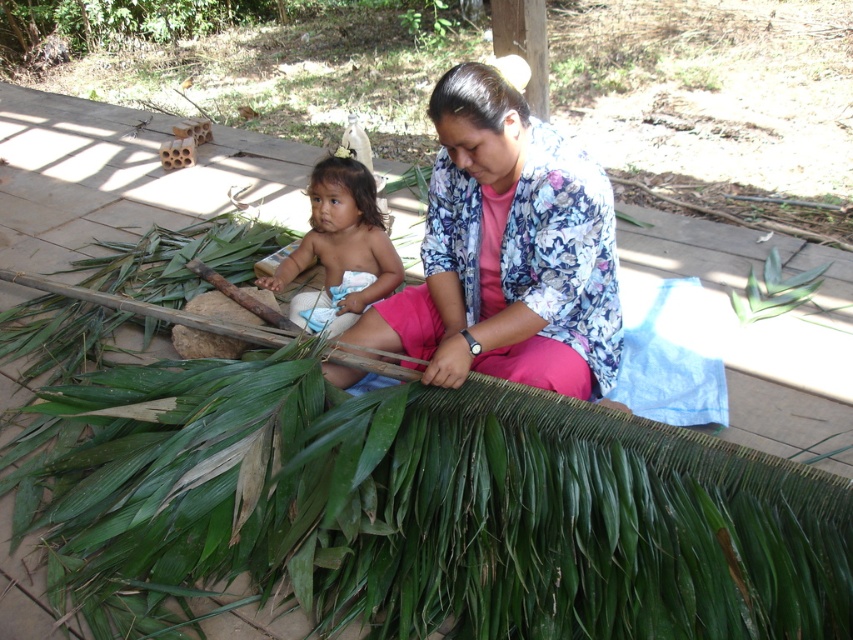
Question: Is floral-patterned fabric at center bigger than green leafy plant at center?

Choices:
 (A) yes
 (B) no

Answer: (A)

Question: Which is farther from the green leafy plant at center?

Choices:
 (A) floral-patterned fabric at center
 (B) light blue cloth at center

Answer: (B)

Question: Which point is farther to the camera?

Choices:
 (A) (573, 349)
 (B) (317, 202)
 (C) (767, 300)

Answer: (C)

Question: Is light blue cloth at center closer to the viewer compared to green leafy plant at center?

Choices:
 (A) yes
 (B) no

Answer: (A)

Question: Which object is positioned closest to the green leafy plant at center?

Choices:
 (A) light blue cloth at center
 (B) floral-patterned fabric at center

Answer: (B)

Question: Is light blue cloth at center smaller than green leafy plant at center?

Choices:
 (A) yes
 (B) no

Answer: (B)